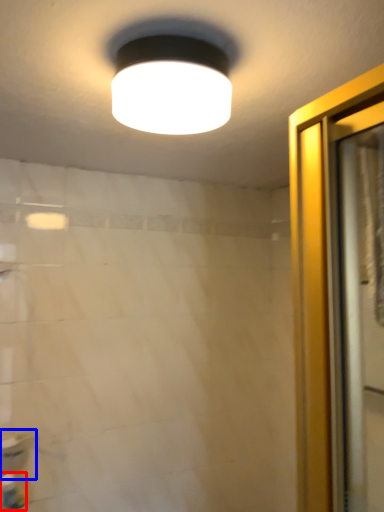
Question: Which object appears farthest to the camera in this image, toiletry (highlighted by a red box) or sink (highlighted by a blue box)?

Choices:
 (A) toiletry
 (B) sink

Answer: (B)